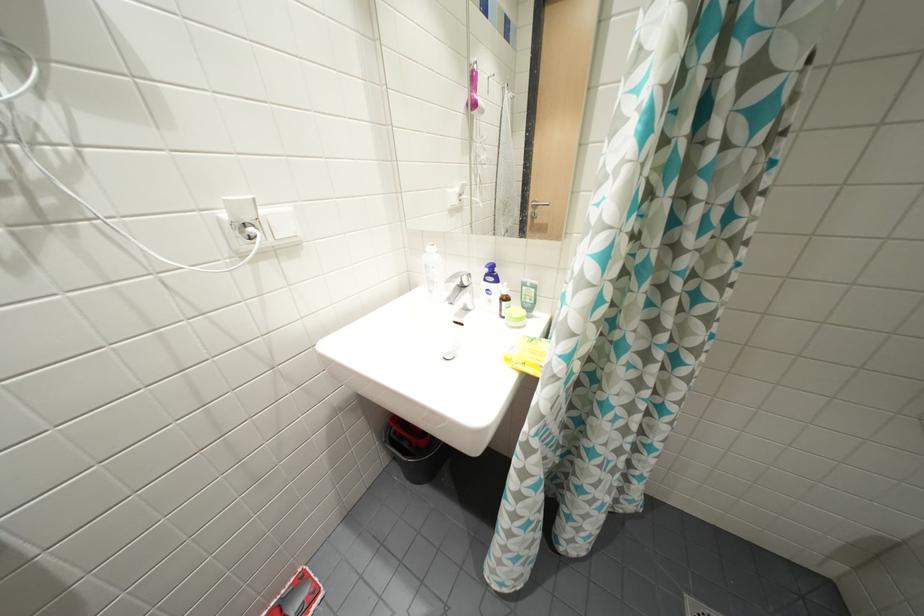
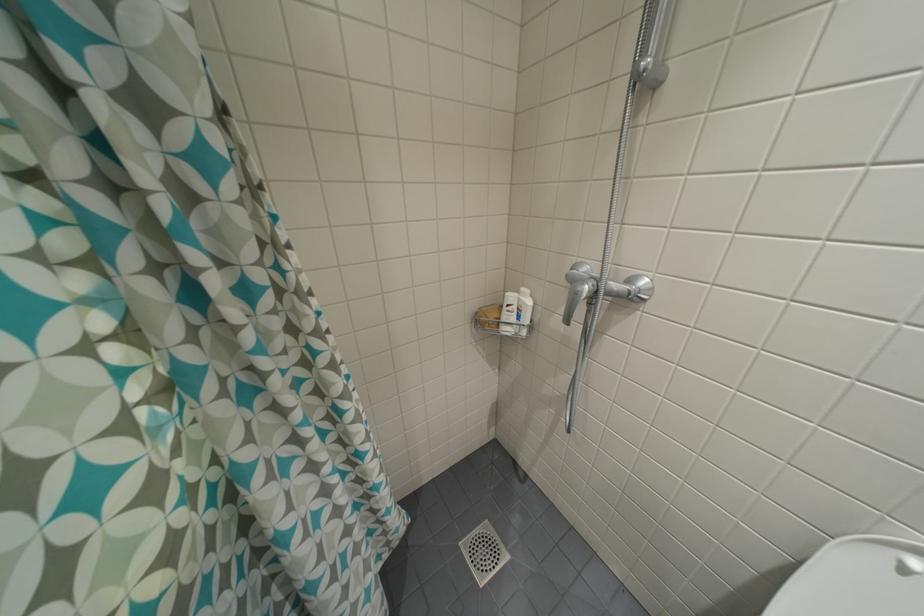
Question: The camera is either moving clockwise (left) or counter-clockwise (right) around the object. The first image is from the beginning of the video and the second image is from the end. Is the camera moving left or right when shooting the video?

Choices:
 (A) Left
 (B) Right

Answer: (A)